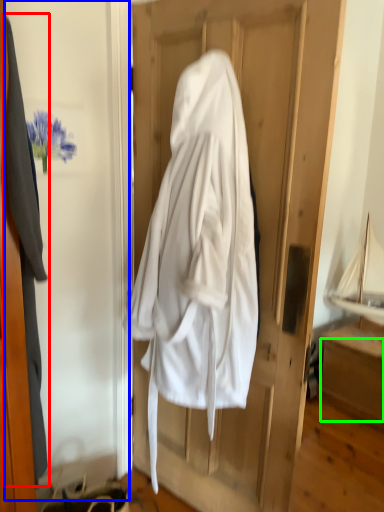
Question: Estimate the real-world distances between objects in this image. Which object is closer to garment (highlighted by a red box), screen door (highlighted by a blue box) or drawer (highlighted by a green box)?

Choices:
 (A) screen door
 (B) drawer

Answer: (A)